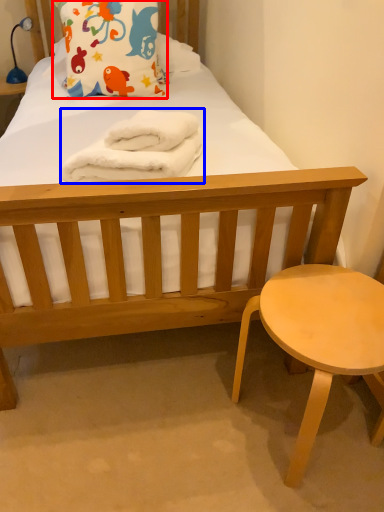
Question: Which object is closer to the camera taking this photo, pillow (highlighted by a red box) or material (highlighted by a blue box)?

Choices:
 (A) pillow
 (B) material

Answer: (B)